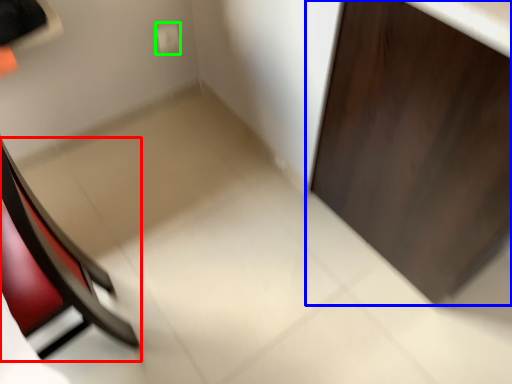
Question: Which object is the farthest from chair (highlighted by a red box)? Choose among these: door (highlighted by a blue box) or electric outlet (highlighted by a green box).

Choices:
 (A) door
 (B) electric outlet

Answer: (B)